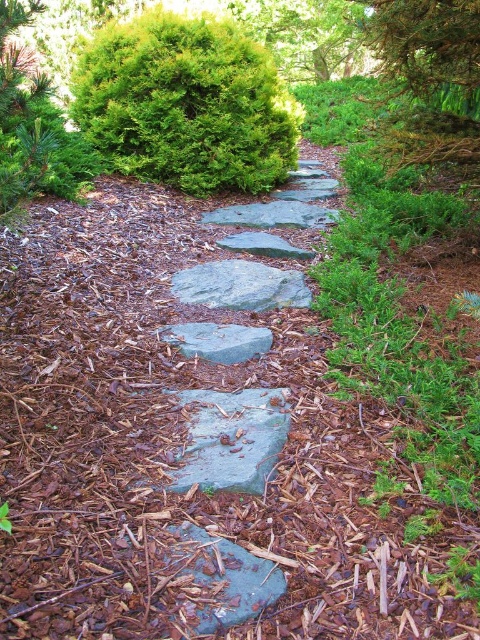
You are standing on the garden pathway and want to place a small decorative stone between the two points labeled point (266, 278) and point (271, 243). Which point should the stone be closer to in order to be nearer to the viewer?

The small decorative stone should be placed closer to point (266, 278) because it is closer to the viewer than point (271, 243).